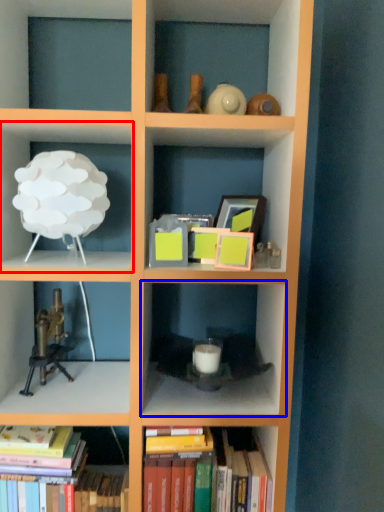
Question: Among these objects, which one is farthest to the camera, shelf (highlighted by a red box) or shelf (highlighted by a blue box)?

Choices:
 (A) shelf
 (B) shelf

Answer: (B)